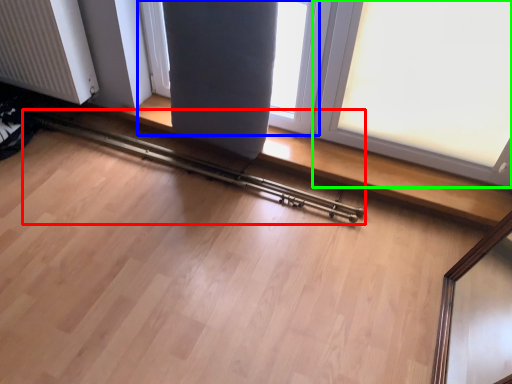
Question: Estimate the real-world distances between objects in this image. Which object is closer to rail (highlighted by a red box), window (highlighted by a blue box) or window (highlighted by a green box)?

Choices:
 (A) window
 (B) window

Answer: (A)